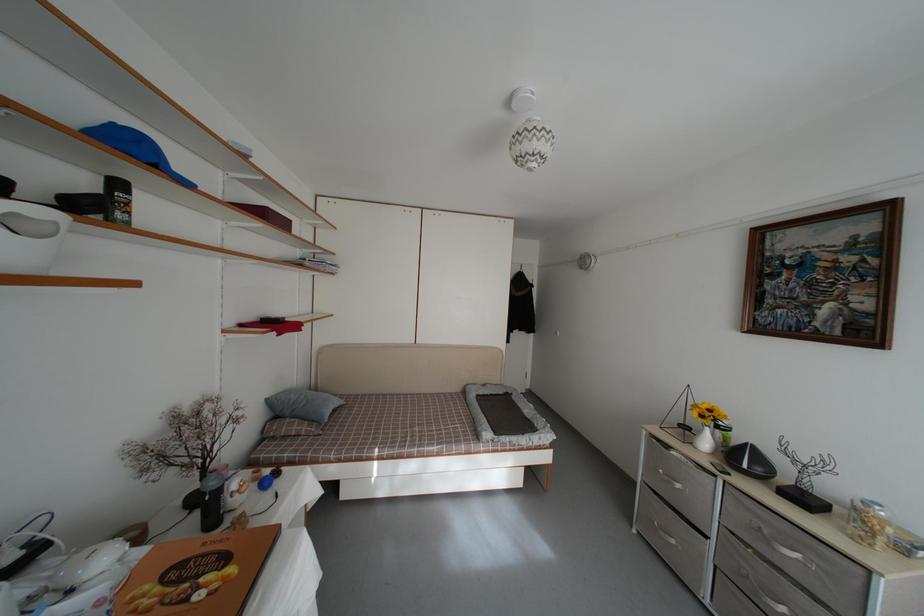
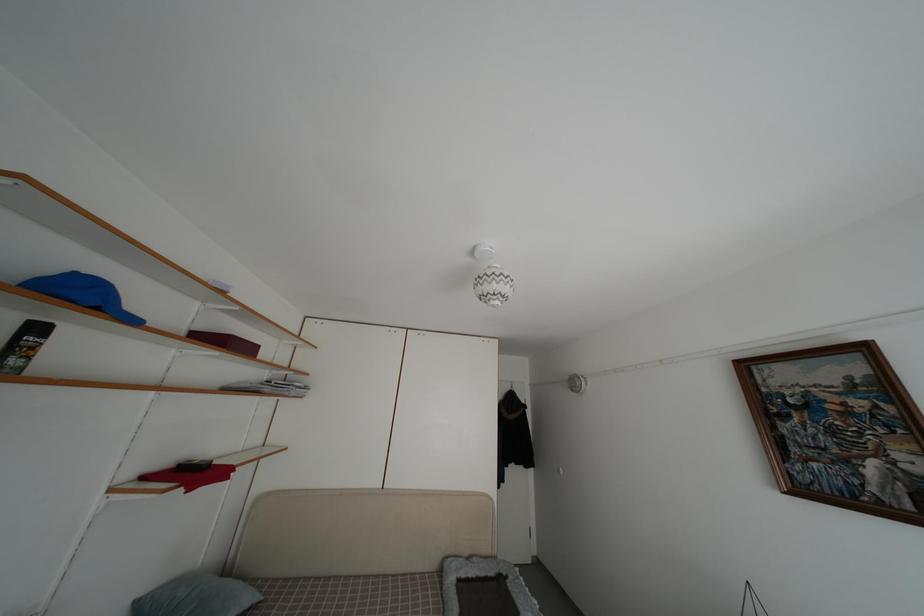
Find the pixel in the second image that matches (126,192) in the first image.

(43, 334)